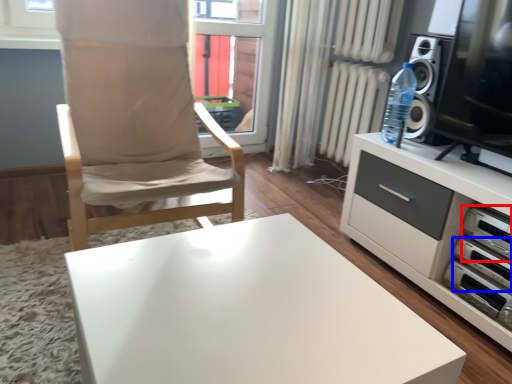
Question: Among these objects, which one is nearest to the camera, appliance (highlighted by a red box) or appliance (highlighted by a blue box)?

Choices:
 (A) appliance
 (B) appliance

Answer: (A)